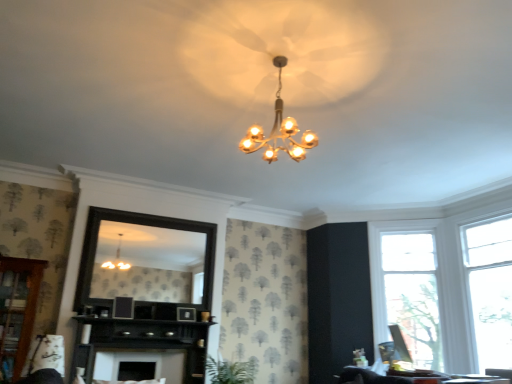
Measure the distance between point (170,365) and camera.

The depth of point (170,365) is 5.73 meters.

What do you see at coordinates (407, 288) in the screenshot? The width and height of the screenshot is (512, 384). I see `clear glass window at right, which is the 1th window in left-to-right order` at bounding box center [407, 288].

Where is `clear glass window at right, marked as the 1th window in a right-to-left arrangement`? This screenshot has height=384, width=512. clear glass window at right, marked as the 1th window in a right-to-left arrangement is located at coordinates (490, 288).

The height and width of the screenshot is (384, 512). What are the coordinates of `green leafy plant at center` in the screenshot? It's located at (230, 371).

You are a GUI agent. You are given a task and a screenshot of the screen. Output one action in this format:
    pyautogui.click(x=<x>, y=<y>)
    Task: Click on the black wooden mirror at center
    The image size is (512, 384).
    Given the screenshot: What is the action you would take?
    pyautogui.click(x=149, y=263)

Based on their sizes in the image, would you say gold metallic chandelier at upper center is bigger or smaller than black wood fireplace at center, the second dresser in the left-to-right sequence?

In the image, gold metallic chandelier at upper center appears to be smaller than black wood fireplace at center, the second dresser in the left-to-right sequence.

Between point (305, 143) and point (83, 324), which one is positioned behind?

The point (83, 324) is more distant.

How different are the orientations of gold metallic chandelier at upper center and black wood fireplace at center, the 1th dresser positioned from the right, in degrees?

The angular difference between gold metallic chandelier at upper center and black wood fireplace at center, the 1th dresser positioned from the right, is 90.5 degrees.

From a real-world perspective, who is located lower, gold metallic chandelier at upper center or black wood fireplace at center, the second dresser in the left-to-right sequence?

black wood fireplace at center, the second dresser in the left-to-right sequence, from a real-world perspective.

Is green leafy plant at center oriented towards white matte fireplace at lower center?

No, green leafy plant at center does not turn towards white matte fireplace at lower center.

Consider the image. From the image's perspective, would you say green leafy plant at center is shown under white matte fireplace at lower center?

No, from the image's perspective, green leafy plant at center is not beneath white matte fireplace at lower center.

Does green leafy plant at center have a smaller size compared to white matte fireplace at lower center?

No.

Based on their positions, is green leafy plant at center located to the left or right of white matte fireplace at lower center?

From the image, it's evident that green leafy plant at center is to the right of white matte fireplace at lower center.

Which object is more forward, white matte fireplace at lower center or clear glass window at right, positioned as the 2th window in left-to-right order?

clear glass window at right, positioned as the 2th window in left-to-right order, is more forward.

Is white matte fireplace at lower center wider than clear glass window at right, marked as the 1th window in a right-to-left arrangement?

Yes, white matte fireplace at lower center is wider than clear glass window at right, marked as the 1th window in a right-to-left arrangement.

Is white matte fireplace at lower center taller or shorter than clear glass window at right, positioned as the 2th window in left-to-right order?

Considering their sizes, white matte fireplace at lower center has less height than clear glass window at right, positioned as the 2th window in left-to-right order.

How distant is white matte fireplace at lower center from clear glass window at right, positioned as the 2th window in left-to-right order?

white matte fireplace at lower center and clear glass window at right, positioned as the 2th window in left-to-right order, are 4.23 meters apart from each other.

From a real-world perspective, who is located higher, black wood fireplace at center, the second dresser in the left-to-right sequence, or wooden dresser at lower left, which appears as the 1th dresser when viewed from the left?

wooden dresser at lower left, which appears as the 1th dresser when viewed from the left, from a real-world perspective.

Which object is positioned more to the right, black wood fireplace at center, the 1th dresser positioned from the right, or wooden dresser at lower left, the second dresser when ordered from right to left?

black wood fireplace at center, the 1th dresser positioned from the right, is more to the right.

What's the angular difference between black wood fireplace at center, the 1th dresser positioned from the right, and wooden dresser at lower left, the second dresser when ordered from right to left,'s facing directions?

black wood fireplace at center, the 1th dresser positioned from the right, and wooden dresser at lower left, the second dresser when ordered from right to left, are facing 0.857 degrees away from each other.

Is black wood fireplace at center, the second dresser in the left-to-right sequence, looking in the opposite direction of wooden dresser at lower left, which appears as the 1th dresser when viewed from the left?

That's not correct — black wood fireplace at center, the second dresser in the left-to-right sequence, is not looking away from wooden dresser at lower left, which appears as the 1th dresser when viewed from the left.

How many degrees apart are the facing directions of wooden dresser at lower left, which appears as the 1th dresser when viewed from the left, and green leafy plant at center?

0.266 degrees.

How far apart are wooden dresser at lower left, which appears as the 1th dresser when viewed from the left, and green leafy plant at center?

wooden dresser at lower left, which appears as the 1th dresser when viewed from the left, and green leafy plant at center are 7.23 feet apart.

Is the depth of wooden dresser at lower left, which appears as the 1th dresser when viewed from the left, less than that of green leafy plant at center?

Yes, wooden dresser at lower left, which appears as the 1th dresser when viewed from the left, is closer to the camera.

Is green leafy plant at center surrounded by wooden dresser at lower left, the second dresser when ordered from right to left?

No, green leafy plant at center is not surrounded by wooden dresser at lower left, the second dresser when ordered from right to left.

Can you confirm if gold metallic chandelier at upper center is wider than clear glass window at right, positioned as the 2th window in left-to-right order?

Correct, the width of gold metallic chandelier at upper center exceeds that of clear glass window at right, positioned as the 2th window in left-to-right order.

Based on the photo, is gold metallic chandelier at upper center not inside clear glass window at right, marked as the 1th window in a right-to-left arrangement?

Yes, gold metallic chandelier at upper center is not within clear glass window at right, marked as the 1th window in a right-to-left arrangement.

Considering the sizes of objects gold metallic chandelier at upper center and clear glass window at right, marked as the 1th window in a right-to-left arrangement, in the image provided, who is smaller, gold metallic chandelier at upper center or clear glass window at right, marked as the 1th window in a right-to-left arrangement,?

gold metallic chandelier at upper center.

Between gold metallic chandelier at upper center and clear glass window at right, marked as the 1th window in a right-to-left arrangement, which one appears on the right side from the viewer's perspective?

clear glass window at right, marked as the 1th window in a right-to-left arrangement, is more to the right.

Can you confirm if clear glass window at right, marked as the 1th window in a right-to-left arrangement, is taller than wooden dresser at lower left, which appears as the 1th dresser when viewed from the left?

Yes.

Is clear glass window at right, marked as the 1th window in a right-to-left arrangement, in contact with wooden dresser at lower left, the second dresser when ordered from right to left?

They are not placed beside each other.

Measure the distance from clear glass window at right, positioned as the 2th window in left-to-right order, to wooden dresser at lower left, the second dresser when ordered from right to left.

The distance of clear glass window at right, positioned as the 2th window in left-to-right order, from wooden dresser at lower left, the second dresser when ordered from right to left, is 5.29 meters.

From a real-world perspective, which object rests below the other?

wooden dresser at lower left, the second dresser when ordered from right to left, from a real-world perspective.

Where is `the 1st dresser to the left of the gold metallic chandelier at upper center, counting from the anchor's position`? The height and width of the screenshot is (384, 512). the 1st dresser to the left of the gold metallic chandelier at upper center, counting from the anchor's position is located at coordinates (144, 342).

The width and height of the screenshot is (512, 384). Identify the location of fireplace lying below the green leafy plant at center (from the image's perspective). (139, 365).

Based on their spatial positions, is clear glass window at right, marked as the 1th window in a right-to-left arrangement, or wooden dresser at lower left, the second dresser when ordered from right to left, closer to clear glass window at right, which is the 1th window in left-to-right order?

clear glass window at right, marked as the 1th window in a right-to-left arrangement, is closer to clear glass window at right, which is the 1th window in left-to-right order.

When comparing their distances from white fabric swivel chair at lower left, does gold metallic chandelier at upper center or black wooden mirror at center seem closer?

black wooden mirror at center is positioned closer to the anchor white fabric swivel chair at lower left.

Looking at the image, which one is located closer to black wooden mirror at center, wooden dresser at lower left, the second dresser when ordered from right to left, or green leafy plant at center?

wooden dresser at lower left, the second dresser when ordered from right to left, is positioned closer to the anchor black wooden mirror at center.

Which object lies further to the anchor point gold metallic chandelier at upper center, black wooden mirror at center or clear glass window at right, positioned as the 2th window in left-to-right order?

clear glass window at right, positioned as the 2th window in left-to-right order, is positioned further to the anchor gold metallic chandelier at upper center.

Based on their spatial positions, is green leafy plant at center or wooden dresser at lower left, which appears as the 1th dresser when viewed from the left, closer to clear glass window at right, which is the 1th window in left-to-right order?

green leafy plant at center is closer to clear glass window at right, which is the 1th window in left-to-right order.

Looking at the image, which one is located closer to green leafy plant at center, gold metallic chandelier at upper center or black wood fireplace at center, the 1th dresser positioned from the right?

black wood fireplace at center, the 1th dresser positioned from the right.

Based on the photo, estimate the real-world distances between objects in this image. Which object is closer to gold metallic chandelier at upper center, black wood fireplace at center, the 1th dresser positioned from the right, or green leafy plant at center?

green leafy plant at center is positioned closer to the anchor gold metallic chandelier at upper center.

Considering their positions, is white matte fireplace at lower center positioned further to wooden dresser at lower left, the second dresser when ordered from right to left, than green leafy plant at center?

Based on the image, green leafy plant at center appears to be further to wooden dresser at lower left, the second dresser when ordered from right to left.

This screenshot has width=512, height=384. What are the coordinates of `plant between wooden dresser at lower left, the second dresser when ordered from right to left, and clear glass window at right, marked as the 1th window in a right-to-left arrangement` in the screenshot? It's located at (230, 371).

Image resolution: width=512 pixels, height=384 pixels. Identify the location of plant between white matte fireplace at lower center and clear glass window at right, placed as the 2th window when sorted from right to left, from left to right. (230, 371).

This screenshot has height=384, width=512. I want to click on dresser located between white fabric swivel chair at lower left and clear glass window at right, positioned as the 2th window in left-to-right order, in the left-right direction, so click(144, 342).

This screenshot has width=512, height=384. Identify the location of plant located between wooden dresser at lower left, which appears as the 1th dresser when viewed from the left, and clear glass window at right, placed as the 2th window when sorted from right to left, in the left-right direction. [230, 371].